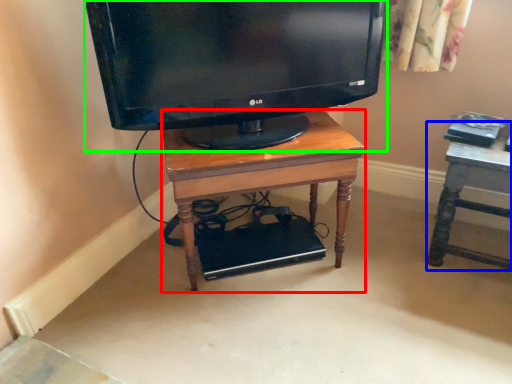
Question: Which object is the farthest from desk (highlighted by a red box)? Choose among these: furniture (highlighted by a blue box) or television (highlighted by a green box).

Choices:
 (A) furniture
 (B) television

Answer: (A)